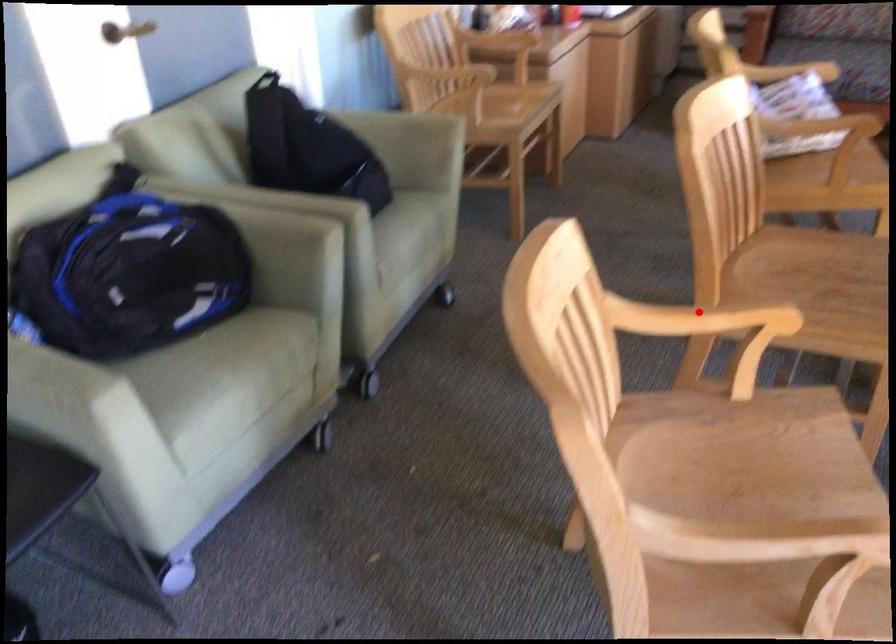
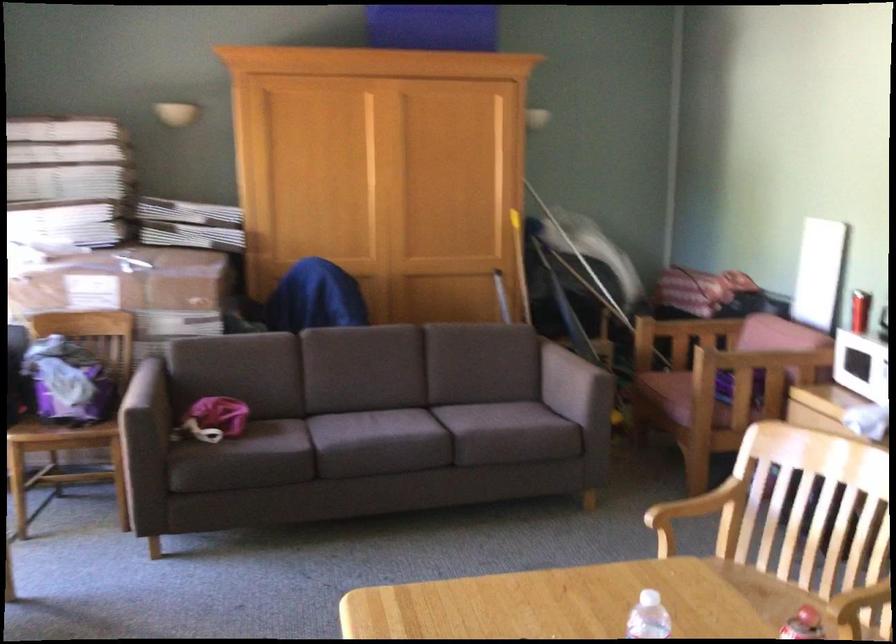
Question: A red point is marked in image1. In image2, is the corresponding 3D point closer to the camera or farther? Reply with the corresponding letter.

Choices:
 (A) The corresponding 3D point is closer.
 (B) The corresponding 3D point is farther.

Answer: (B)